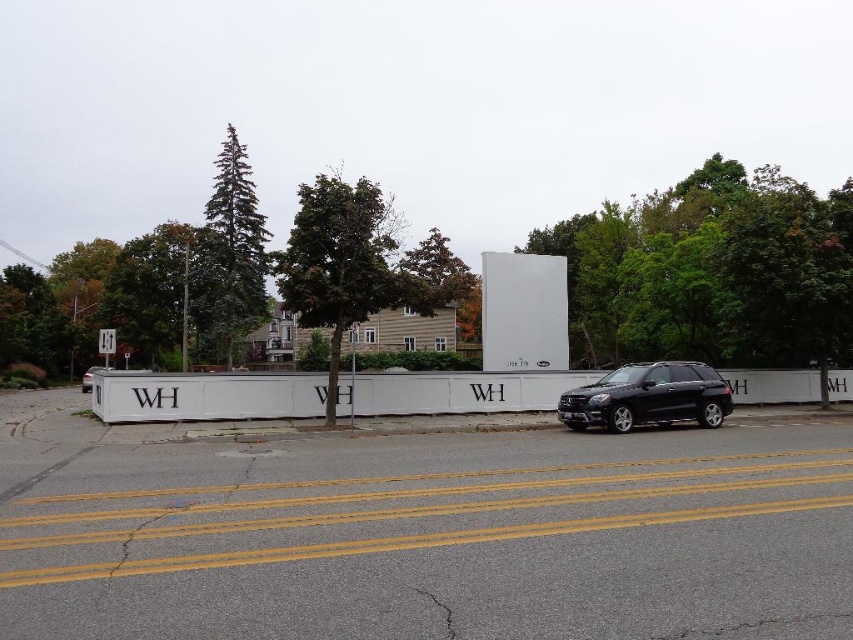
Question: Can you confirm if green leafy tree at center is positioned above black matte suv at center?

Choices:
 (A) yes
 (B) no

Answer: (A)

Question: Which object appears closest to the camera in this image?

Choices:
 (A) black matte suv at center
 (B) green leafy tree at center
 (C) shiny black suv at center
 (D) green needle-like tree at upper left

Answer: (A)

Question: Can you confirm if green leafy tree at center is wider than green needle-like tree at upper left?

Choices:
 (A) yes
 (B) no

Answer: (B)

Question: Which point is farther to the camera?

Choices:
 (A) (306, 266)
 (B) (82, 380)

Answer: (B)

Question: Is the position of green leafy tree at center less distant than that of shiny black suv at center?

Choices:
 (A) yes
 (B) no

Answer: (A)

Question: Which of the following is the closest to the observer?

Choices:
 (A) (300, 198)
 (B) (86, 372)
 (C) (253, 276)

Answer: (A)